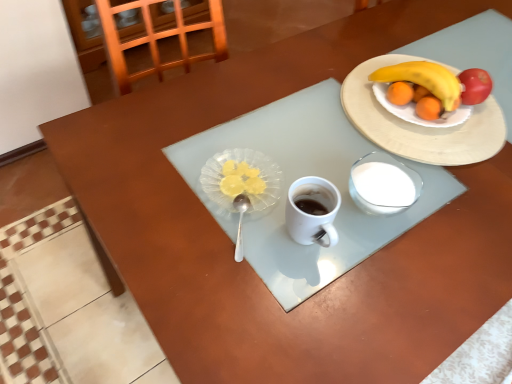
The height and width of the screenshot is (384, 512). I want to click on vacant area on the back side of yellow matte banana at upper right, so click(x=399, y=48).